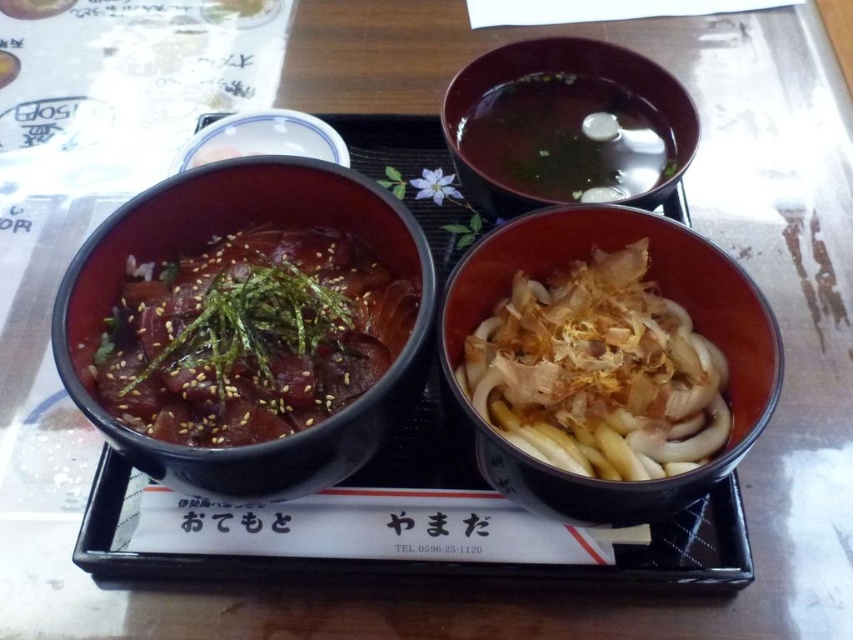
You are a food delivery person who needs to place a hot beverage in the center of the tray. The tray has a matte brown bowl at center. Can you place the beverage there without disturbing the bowl?

The matte brown bowl at center is located at point (x=662, y=294), so placing the beverage at the exact center of the tray would require moving the bowl, meaning you cannot place the beverage there without disturbing it.

You are arranging dishes on a black rectangular tray for a meal. You have a matte brown bowl at center and a matte ceramic bowl at upper center. According to their positions, which bowl is located to the left?

The matte ceramic bowl at upper center is to the left of the matte brown bowl at center, so the matte ceramic bowl at upper center is located to the left.

You are a chef preparing a dish and need to choose between the matte black bowl at left and the brown glossy bowl at upper center. Which bowl is taller?

The matte black bowl at left is taller than the brown glossy bowl at upper center according to the description.